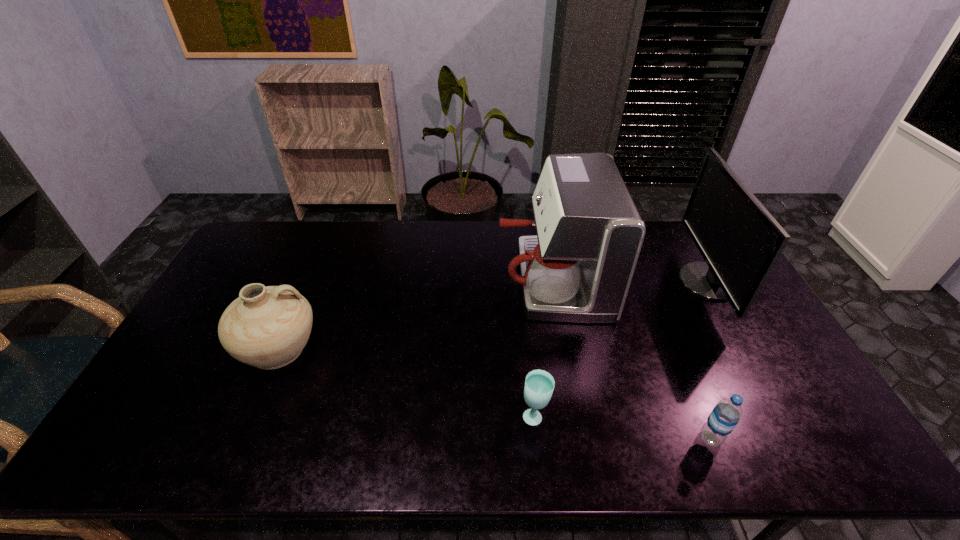
The image size is (960, 540). What are the coordinates of `vacant area between the third shortest object and the second object from right to left` in the screenshot? It's located at (494, 393).

You are a GUI agent. You are given a task and a screenshot of the screen. Output one action in this format:
    pyautogui.click(x=<x>, y=<y>)
    Task: Click on the free space between the rightmost object and the third tallest object
    The image size is (960, 540).
    Given the screenshot: What is the action you would take?
    pyautogui.click(x=493, y=315)

Image resolution: width=960 pixels, height=540 pixels. I want to click on free space between the coffee maker and the water bottle, so click(x=631, y=359).

This screenshot has width=960, height=540. I want to click on free space between the nearest object and the coffee maker, so click(631, 359).

This screenshot has width=960, height=540. I want to click on free area in between the monitor and the shortest object, so click(621, 349).

The height and width of the screenshot is (540, 960). What are the coordinates of `free space between the fourth object from left to right and the coffee maker` in the screenshot? It's located at (x=631, y=359).

Find the location of `object identified as the fourth closest to the coffee maker`. object identified as the fourth closest to the coffee maker is located at coordinates (267, 327).

At what (x,y) coordinates should I click in order to perform the action: click on the third closest object to the rightmost object. Please return your answer as a coordinate pair (x, y). This screenshot has height=540, width=960. Looking at the image, I should click on (539, 385).

You are a GUI agent. You are given a task and a screenshot of the screen. Output one action in this format:
    pyautogui.click(x=<x>, y=<y>)
    Task: Click on the free space in the image that satisfies the following two spatial constraints: 1. on the front of the coffee maker near the spout; 2. on the front side of the third tallest object
    This screenshot has width=960, height=540.
    Given the screenshot: What is the action you would take?
    pyautogui.click(x=564, y=348)